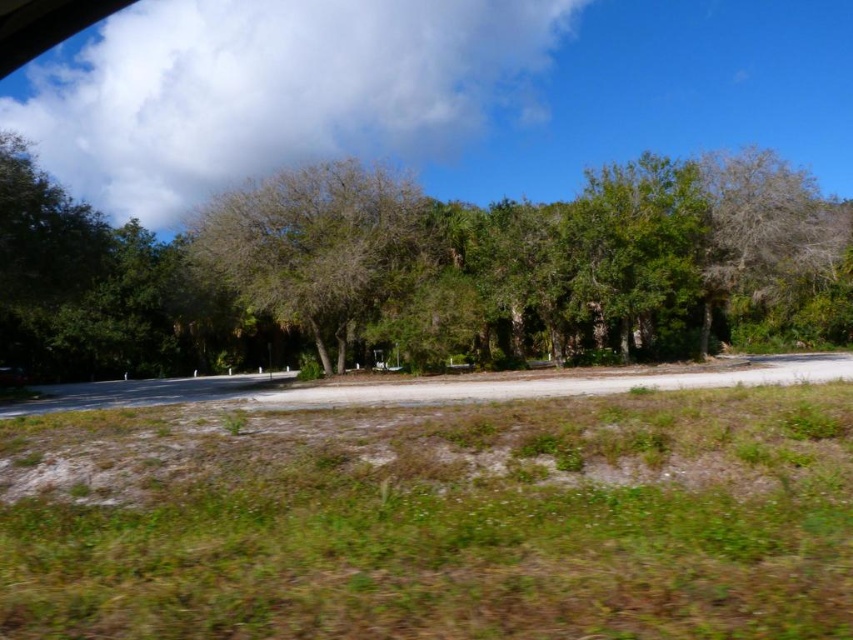
Can you confirm if green grass at lower center is smaller than green leafy tree at center?

Correct, green grass at lower center occupies less space than green leafy tree at center.

Can you confirm if green grass at lower center is shorter than green leafy tree at center?

Yes, green grass at lower center is shorter than green leafy tree at center.

This screenshot has width=853, height=640. Identify the location of green grass at lower center. (434, 520).

Find the location of `green grass at lower center`. green grass at lower center is located at coordinates (x=434, y=520).

Is point (149, 342) in front of point (339, 188)?

No, (149, 342) is further to viewer.

Is green leafy tree at center bigger than brown textured tree at center?

Correct, green leafy tree at center is larger in size than brown textured tree at center.

Locate an element on the screen. This screenshot has height=640, width=853. green leafy tree at center is located at coordinates (386, 276).

Between green grass at lower center and brown textured tree at center, which one has less height?

With less height is green grass at lower center.

Is green grass at lower center positioned before brown textured tree at center?

Yes, it is in front of brown textured tree at center.

What do you see at coordinates (434, 520) in the screenshot?
I see `green grass at lower center` at bounding box center [434, 520].

Find the location of `green grass at lower center`. green grass at lower center is located at coordinates (434, 520).